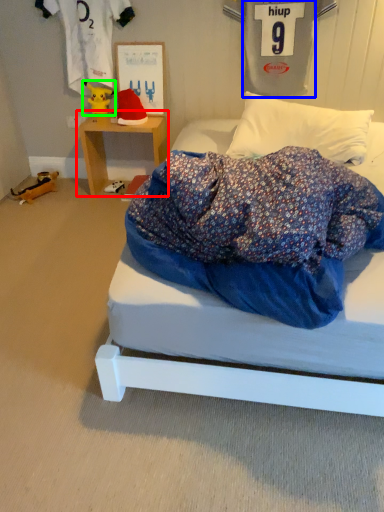
Question: Which is farther away from table (highlighted by a red box)? clothing (highlighted by a blue box) or toy (highlighted by a green box)?

Choices:
 (A) clothing
 (B) toy

Answer: (A)